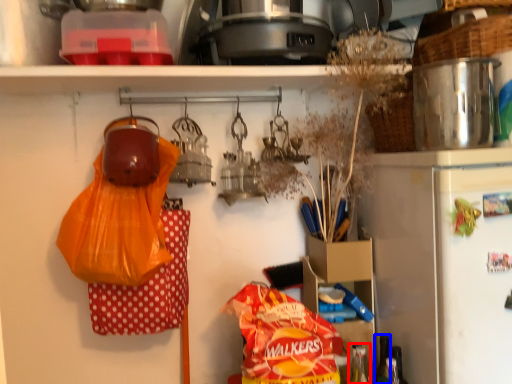
Question: Which of the following is the farthest to the observer, bottle (highlighted by a red box) or bottle (highlighted by a blue box)?

Choices:
 (A) bottle
 (B) bottle

Answer: (B)